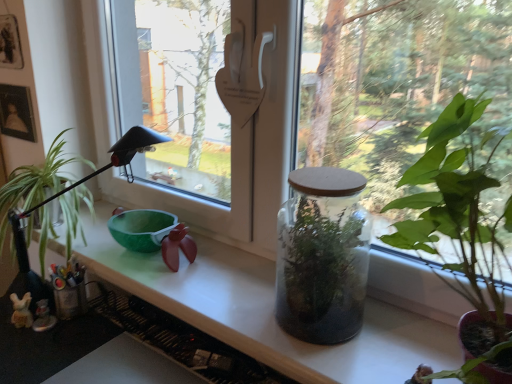
The width and height of the screenshot is (512, 384). What are the coordinates of `translucent glass jar at center` in the screenshot? It's located at (266, 311).

At what (x,y) coordinates should I click in order to perform the action: click on translucent glass terrarium at center, marked as the first houseplant in a right-to-left arrangement. Please return your answer as a coordinate pair (x, y). The width and height of the screenshot is (512, 384). Looking at the image, I should click on (463, 234).

Based on the photo, from the image's perspective, which one is positioned lower, green glossy houseplant at left, the 1th houseplant in the back-to-front sequence, or translucent glass jar at center?

translucent glass jar at center, from the image's perspective.

Would you say green glossy houseplant at left, placed as the first houseplant when sorted from left to right, is inside or outside translucent glass jar at center?

green glossy houseplant at left, placed as the first houseplant when sorted from left to right, is not inside translucent glass jar at center, it's outside.

Is green glossy houseplant at left, which is the second houseplant in front-to-back order, taller than translucent glass jar at center?

Yes.

In the scene shown: Which of these two, green glossy houseplant at left, marked as the second houseplant in a right-to-left arrangement, or translucent glass jar at center, is thinner?

translucent glass jar at center.

Can you confirm if translucent glass jar at center is smaller than transparent glass jar at center?

Actually, translucent glass jar at center might be larger than transparent glass jar at center.

Is translucent glass jar at center wider or thinner than transparent glass jar at center?

translucent glass jar at center is wider than transparent glass jar at center.

Is translucent glass jar at center oriented towards transparent glass jar at center?

No, translucent glass jar at center is not facing towards transparent glass jar at center.

Is translucent glass jar at center in front of transparent glass jar at center?

That is True.

In the scene shown: Can you confirm if translucent glass terrarium at center, arranged as the 1th houseplant when viewed from the front, is bigger than green glossy houseplant at left, which is the second houseplant in front-to-back order?

No.

Considering the points (460, 180) and (21, 230), which point is in front, point (460, 180) or point (21, 230)?

Point (460, 180)

Would you say translucent glass terrarium at center, marked as the first houseplant in a right-to-left arrangement, is to the left or to the right of green glossy houseplant at left, the 1th houseplant in the back-to-front sequence, in the picture?

In the image, translucent glass terrarium at center, marked as the first houseplant in a right-to-left arrangement, appears on the right side of green glossy houseplant at left, the 1th houseplant in the back-to-front sequence.

Between translucent glass terrarium at center, the 2th houseplant from the left, and green glossy houseplant at left, marked as the second houseplant in a right-to-left arrangement, which one has more height?

translucent glass terrarium at center, the 2th houseplant from the left.

Which point is more distant from viewer, (150,143) or (490,324)?

The point (150,143) is more distant.

Which is in front, green glossy houseplant at left, which is the second houseplant in front-to-back order, or translucent glass terrarium at center, arranged as the 1th houseplant when viewed from the front?

translucent glass terrarium at center, arranged as the 1th houseplant when viewed from the front, is in front.

Could you tell me if green glossy houseplant at left, marked as the second houseplant in a right-to-left arrangement, is turned towards translucent glass terrarium at center, the 2th houseplant from the left?

No, green glossy houseplant at left, marked as the second houseplant in a right-to-left arrangement, is not aimed at translucent glass terrarium at center, the 2th houseplant from the left.

Which of these two, green glossy houseplant at left, marked as the second houseplant in a right-to-left arrangement, or translucent glass terrarium at center, arranged as the 1th houseplant when viewed from the front, is thinner?

With smaller width is green glossy houseplant at left, marked as the second houseplant in a right-to-left arrangement.

How far apart are transparent glass jar at center and green glossy houseplant at left, which is the second houseplant in front-to-back order?

transparent glass jar at center is 29.66 inches from green glossy houseplant at left, which is the second houseplant in front-to-back order.

From the picture: Which object is closer to the camera, transparent glass jar at center or green glossy houseplant at left, marked as the second houseplant in a right-to-left arrangement?

transparent glass jar at center is more forward.

Which is behind, point (356, 186) or point (119, 151)?

The point (356, 186) is farther.

From the picture: Is transparent glass jar at center turned away from green glossy houseplant at left, the 1th houseplant in the back-to-front sequence?

transparent glass jar at center does not have its back to green glossy houseplant at left, the 1th houseplant in the back-to-front sequence.

Is green glossy houseplant at left, which is the second houseplant in front-to-back order, not inside transparent glass jar at center?

That's correct, green glossy houseplant at left, which is the second houseplant in front-to-back order, is outside of transparent glass jar at center.

Considering the sizes of objects green glossy houseplant at left, the 1th houseplant in the back-to-front sequence, and transparent glass jar at center in the image provided, who is shorter, green glossy houseplant at left, the 1th houseplant in the back-to-front sequence, or transparent glass jar at center?

Standing shorter between the two is transparent glass jar at center.

From the image's perspective, is green glossy houseplant at left, the 1th houseplant in the back-to-front sequence, located above transparent glass jar at center?

Correct, green glossy houseplant at left, the 1th houseplant in the back-to-front sequence, appears higher than transparent glass jar at center in the image.

From the picture: From the image's perspective, which is below, transparent glass jar at center or green glossy houseplant at left, which is the second houseplant in front-to-back order?

green glossy houseplant at left, which is the second houseplant in front-to-back order, appears lower in the image.

From a real-world perspective, which object rests below the other?

green glossy houseplant at left, marked as the second houseplant in a right-to-left arrangement.

Is transparent glass jar at center not inside green glossy houseplant at left, the 1th houseplant in the back-to-front sequence?

Absolutely, transparent glass jar at center is external to green glossy houseplant at left, the 1th houseplant in the back-to-front sequence.

Visually, is transparent glass jar at center positioned to the left or to the right of green glossy houseplant at left, the 1th houseplant in the back-to-front sequence?

transparent glass jar at center is to the right of green glossy houseplant at left, the 1th houseplant in the back-to-front sequence.

In order to click on houseplant that is on the left side of translucent glass jar at center in this screenshot , I will do `click(78, 185)`.

This screenshot has height=384, width=512. Identify the location of counter top in front of the transparent glass jar at center. (266, 311).

From the image, which object appears to be farther from translucent glass jar at center, transparent glass jar at center or green glossy houseplant at left, the 1th houseplant in the back-to-front sequence?

Based on the image, green glossy houseplant at left, the 1th houseplant in the back-to-front sequence, appears to be further to translucent glass jar at center.

Looking at the image, which one is located closer to green glossy houseplant at left, which is the second houseplant in front-to-back order, transparent glass jar at center or translucent glass terrarium at center, arranged as the 1th houseplant when viewed from the front?

transparent glass jar at center is closer to green glossy houseplant at left, which is the second houseplant in front-to-back order.

Which object lies further to the anchor point translucent glass terrarium at center, marked as the first houseplant in a right-to-left arrangement, green glossy houseplant at left, the 1th houseplant in the back-to-front sequence, or transparent glass jar at center?

Among the two, green glossy houseplant at left, the 1th houseplant in the back-to-front sequence, is located further to translucent glass terrarium at center, marked as the first houseplant in a right-to-left arrangement.

Estimate the real-world distances between objects in this image. Which object is further from transparent glass jar at center, green glossy houseplant at left, which is the second houseplant in front-to-back order, or translucent glass jar at center?

green glossy houseplant at left, which is the second houseplant in front-to-back order, is further to transparent glass jar at center.

When comparing their distances from green glossy houseplant at left, marked as the second houseplant in a right-to-left arrangement, does translucent glass terrarium at center, the 2th houseplant from the left, or transparent glass jar at center seem further?

translucent glass terrarium at center, the 2th houseplant from the left, is further to green glossy houseplant at left, marked as the second houseplant in a right-to-left arrangement.

Considering their positions, is green glossy houseplant at left, placed as the first houseplant when sorted from left to right, positioned further to transparent glass jar at center than transparent glass jar at center?

green glossy houseplant at left, placed as the first houseplant when sorted from left to right, is further to transparent glass jar at center.

Which object lies further to the anchor point translucent glass jar at center, translucent glass terrarium at center, which appears as the 2th houseplant when viewed from the back, or green glossy houseplant at left, placed as the first houseplant when sorted from left to right?

The object further to translucent glass jar at center is green glossy houseplant at left, placed as the first houseplant when sorted from left to right.

Which object lies nearer to the anchor point green glossy houseplant at left, marked as the second houseplant in a right-to-left arrangement, transparent glass jar at center or translucent glass terrarium at center, arranged as the 1th houseplant when viewed from the front?

transparent glass jar at center is closer to green glossy houseplant at left, marked as the second houseplant in a right-to-left arrangement.

This screenshot has height=384, width=512. I want to click on glass jar that lies between transparent glass jar at center and translucent glass jar at center from top to bottom, so click(x=322, y=256).

Where is `counter top located between green glossy houseplant at left, marked as the second houseplant in a right-to-left arrangement, and translucent glass terrarium at center, the 2th houseplant from the left, in the left-right direction`? counter top located between green glossy houseplant at left, marked as the second houseplant in a right-to-left arrangement, and translucent glass terrarium at center, the 2th houseplant from the left, in the left-right direction is located at coordinates (266, 311).

Identify the location of window between green glossy houseplant at left, placed as the first houseplant when sorted from left to right, and transparent glass jar at center. The height and width of the screenshot is (384, 512). (292, 101).

Find the location of `glass jar between translucent glass jar at center and translucent glass terrarium at center, marked as the first houseplant in a right-to-left arrangement, in the horizontal direction`. glass jar between translucent glass jar at center and translucent glass terrarium at center, marked as the first houseplant in a right-to-left arrangement, in the horizontal direction is located at coordinates (322, 256).